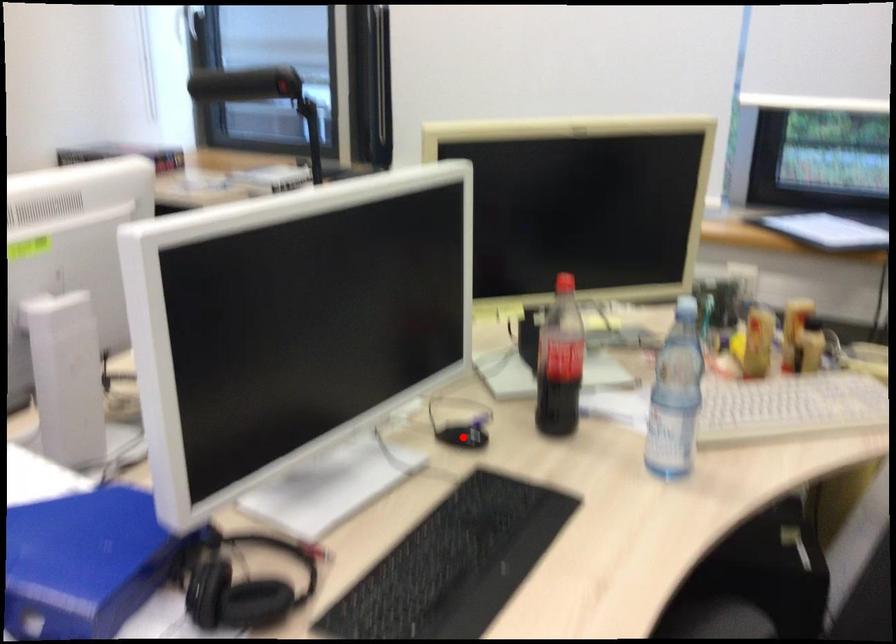
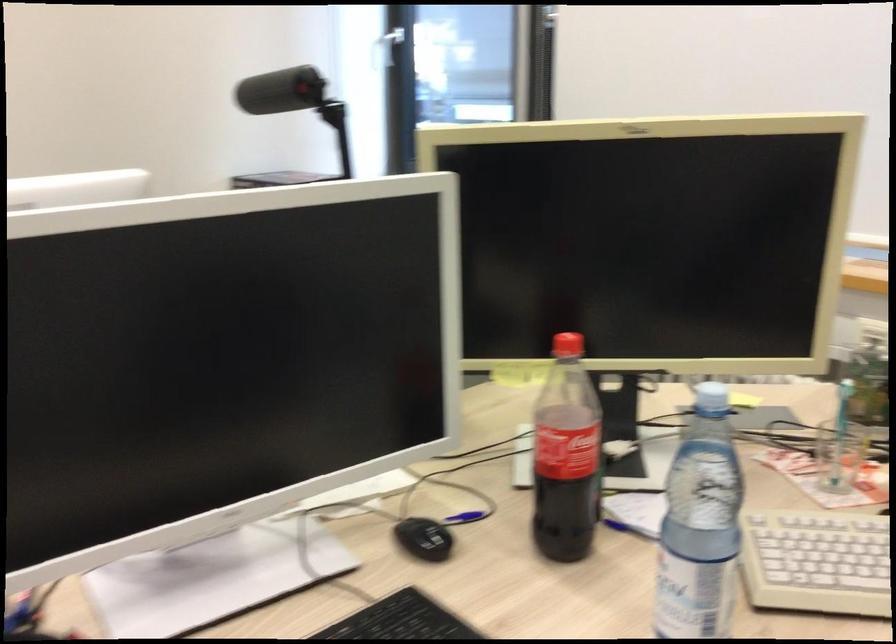
Question: A red point is marked in image1. In image2, is the corresponding 3D point closer to the camera or farther? Reply with the corresponding letter.

Choices:
 (A) The corresponding 3D point is closer.
 (B) The corresponding 3D point is farther.

Answer: (A)